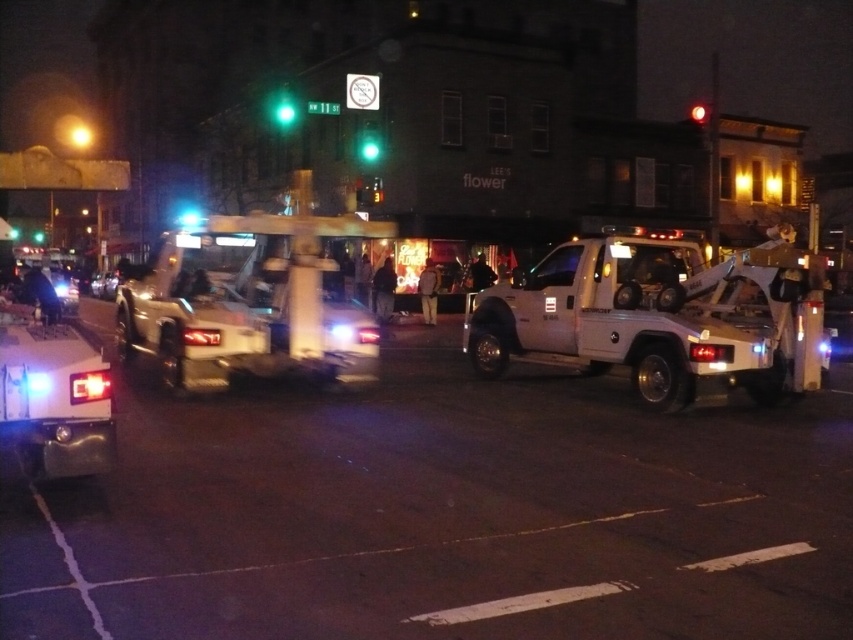
Question: Does green glass traffic light at center appear on the left side of red glass traffic light at upper center?

Choices:
 (A) yes
 (B) no

Answer: (A)

Question: Which object appears closest to the camera in this image?

Choices:
 (A) metallic silver car at center
 (B) green glass traffic light at center
 (C) white matte tow truck at center
 (D) black leather jacket at center

Answer: (C)

Question: Which point appears closest to the camera in this image?

Choices:
 (A) (479, 257)
 (B) (701, 364)
 (C) (39, 301)
 (D) (704, 108)

Answer: (B)

Question: Which point is closer to the camera?

Choices:
 (A) coord(476,266)
 (B) coord(364,157)

Answer: (A)

Question: Is metallic silver car at center further to camera compared to red glass traffic light at upper center?

Choices:
 (A) yes
 (B) no

Answer: (A)

Question: Is white metallic tow truck at center positioned behind metallic silver car at center?

Choices:
 (A) no
 (B) yes

Answer: (A)